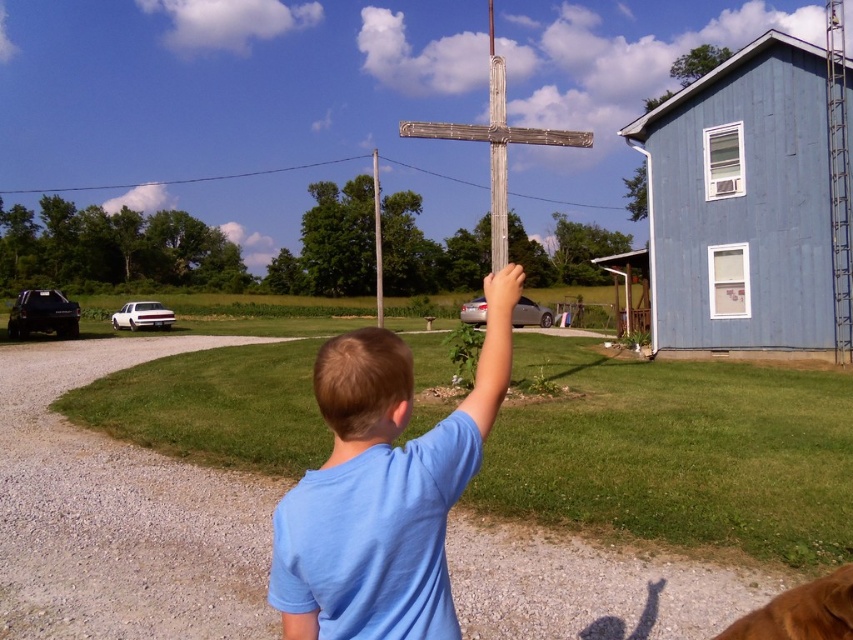
Question: Which object is positioned farthest from the brown furry dog at lower right?

Choices:
 (A) brown wooden telegraph pole at center
 (B) wooden cross at upper center

Answer: (A)

Question: Which of the following is the closest to the observer?

Choices:
 (A) (799, 584)
 (B) (328, 518)

Answer: (B)

Question: Is blue cotton shirt at center below wooden cross at upper center?

Choices:
 (A) no
 (B) yes

Answer: (B)

Question: Does wooden cross at upper center appear on the right side of brown wooden telegraph pole at center?

Choices:
 (A) yes
 (B) no

Answer: (A)

Question: Which object is closer to the camera taking this photo?

Choices:
 (A) blue cotton shirt at center
 (B) wooden cross at upper center

Answer: (A)

Question: Can you confirm if blue cotton shirt at center is wider than brown furry dog at lower right?

Choices:
 (A) no
 (B) yes

Answer: (B)